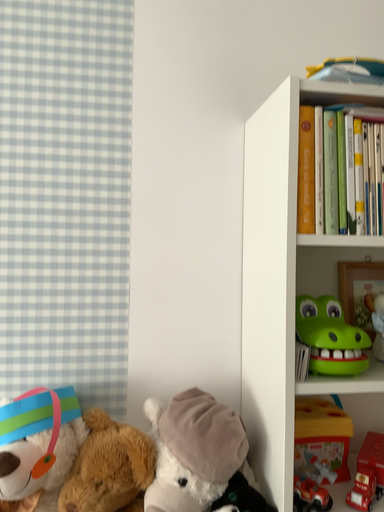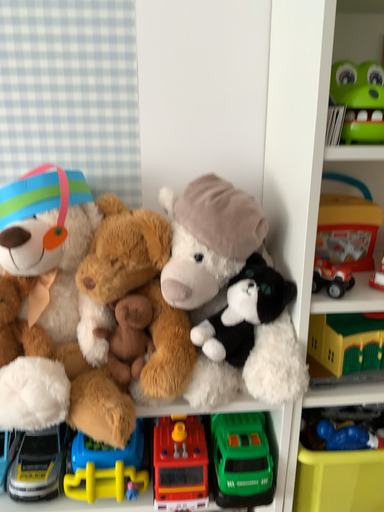
Question: Which way did the camera rotate in the video?

Choices:
 (A) rotated downward
 (B) rotated upward

Answer: (A)